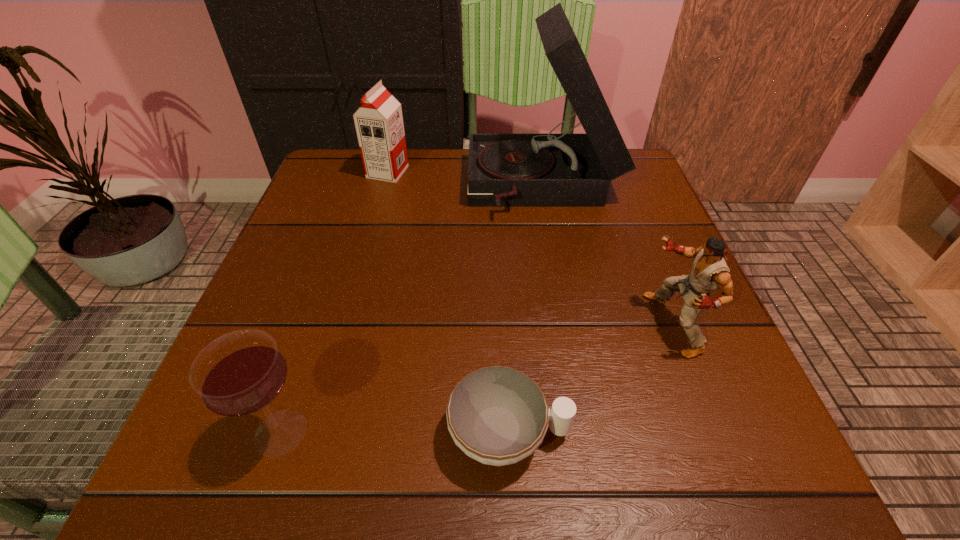
Find the location of a particular element. The image size is (960, 540). vacant area located on the front-facing side of the third nearest object is located at coordinates (618, 324).

Find the location of `free spot located on the front-facing side of the third nearest object`. free spot located on the front-facing side of the third nearest object is located at coordinates (435, 324).

Locate an element on the screen. free space located on the right of the wineglass is located at coordinates (562, 432).

At what (x,y) coordinates should I click in order to perform the action: click on vacant area located 0.070m on the side with the handle of the chinaware. Please return your answer as a coordinate pair (x, y). The height and width of the screenshot is (540, 960). Looking at the image, I should click on (620, 434).

At what (x,y) coordinates should I click in order to perform the action: click on phonograph_record situated at the far edge. Please return your answer as a coordinate pair (x, y). This screenshot has width=960, height=540. Looking at the image, I should click on (505, 170).

Locate an element on the screen. The width and height of the screenshot is (960, 540). soya milk situated at the far edge is located at coordinates point(379,125).

In order to click on wineglass that is at the near edge in this screenshot , I will do `click(241, 373)`.

Locate an element on the screen. This screenshot has height=540, width=960. chinaware at the near edge is located at coordinates click(496, 415).

Locate an element on the screen. The height and width of the screenshot is (540, 960). soya milk that is at the left edge is located at coordinates (379, 125).

This screenshot has width=960, height=540. Find the location of `wineglass that is positioned at the left edge`. wineglass that is positioned at the left edge is located at coordinates (241, 373).